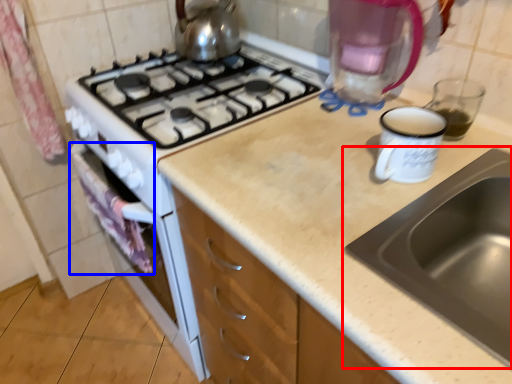
Question: Which object appears farthest to the camera in this image, sink (highlighted by a red box) or cloth (highlighted by a blue box)?

Choices:
 (A) sink
 (B) cloth

Answer: (B)